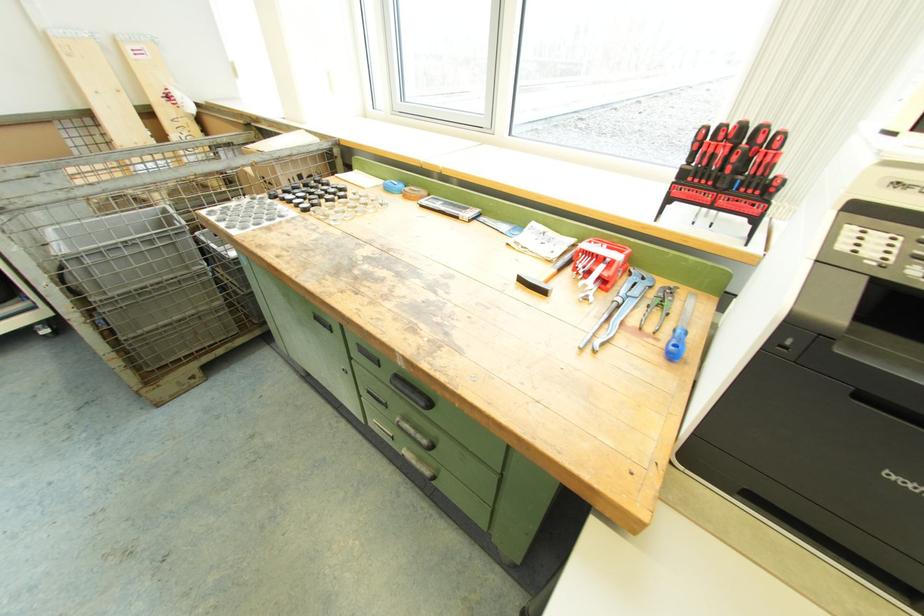
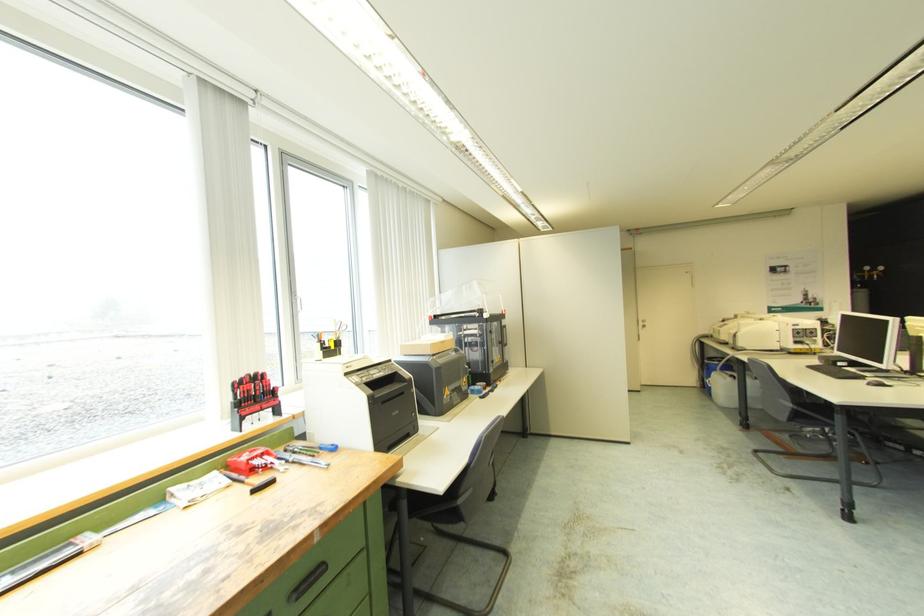
In the second image, find the point that corresponds to point 588,246 in the first image.

(248, 458)